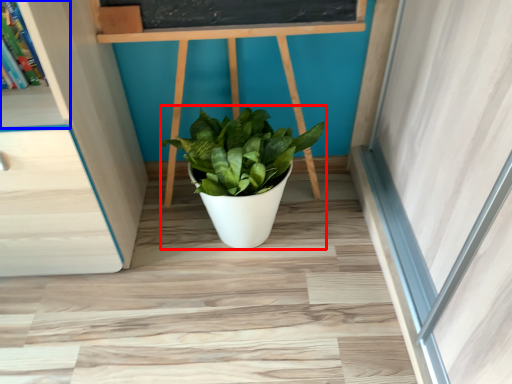
Question: Which object is closer to the camera taking this photo, houseplant (highlighted by a red box) or shelf (highlighted by a blue box)?

Choices:
 (A) houseplant
 (B) shelf

Answer: (B)